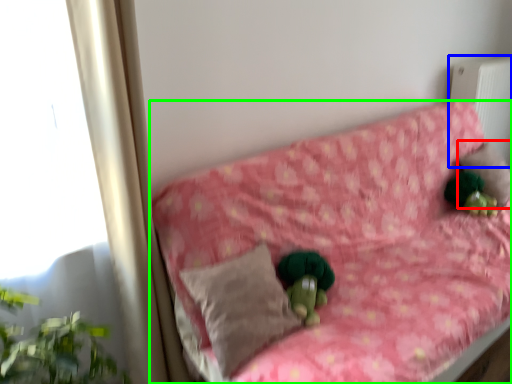
Question: Considering the real-world distances, which object is closest to pillow (highlighted by a red box)? radiator (highlighted by a blue box) or furniture (highlighted by a green box).

Choices:
 (A) radiator
 (B) furniture

Answer: (A)